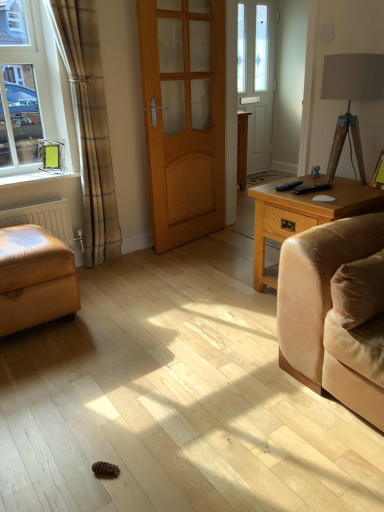
Image resolution: width=384 pixels, height=512 pixels. I want to click on vacant space situated on the left part of light brown wooden side table at right, so click(x=228, y=297).